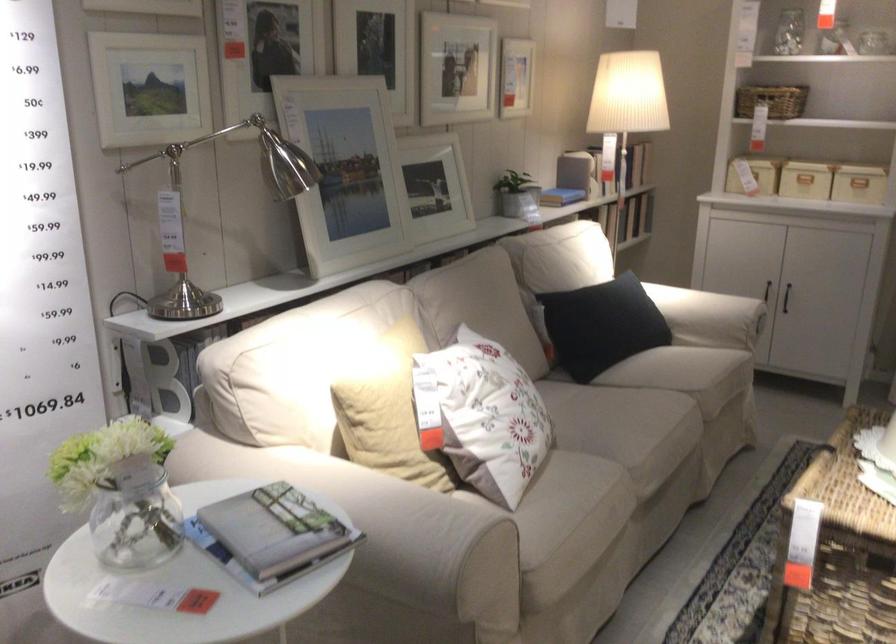
Where is `glass flower vase`? Image resolution: width=896 pixels, height=644 pixels. glass flower vase is located at coordinates (134, 516).